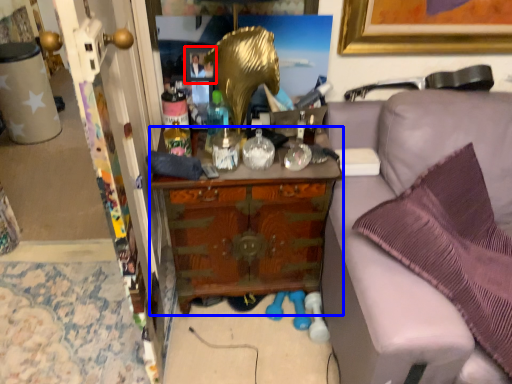
Question: Which of the following is the closest to the observer, picture frame (highlighted by a red box) or cabinetry (highlighted by a blue box)?

Choices:
 (A) picture frame
 (B) cabinetry

Answer: (B)